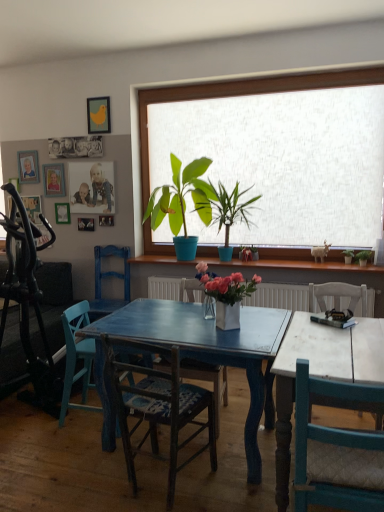
Question: Is teal wood chair at right, the fifth chair from the back, at the back of blue painted wood chair at left, which appears as the fifth chair when viewed from the front?

Choices:
 (A) yes
 (B) no

Answer: (B)

Question: From the image's perspective, is blue painted wood chair at left, which is counted as the first chair, starting from the back, under teal wood chair at right, the first chair from the front?

Choices:
 (A) no
 (B) yes

Answer: (A)

Question: Could teal wood chair at right, the fifth chair from the back, be considered to be inside blue painted wood chair at left, which is counted as the first chair, starting from the back?

Choices:
 (A) no
 (B) yes

Answer: (A)

Question: Considering the relative sizes of blue painted wood chair at left, which appears as the fifth chair when viewed from the front, and teal wood chair at right, the first chair from the front, in the image provided, is blue painted wood chair at left, which appears as the fifth chair when viewed from the front, shorter than teal wood chair at right, the first chair from the front,?

Choices:
 (A) no
 (B) yes

Answer: (B)

Question: Can you confirm if blue painted wood chair at left, which is counted as the first chair, starting from the back, is positioned to the right of teal wood chair at right, the fifth chair from the back?

Choices:
 (A) no
 (B) yes

Answer: (A)

Question: Could you tell me if blue painted wood chair at left, which is counted as the first chair, starting from the back, is facing teal wood chair at right, the first chair from the front?

Choices:
 (A) no
 (B) yes

Answer: (A)

Question: Are wooden photo frame at upper left, the fifth picture frame positioned from the right, and teal wood chair at right, the fifth chair from the back, far apart?

Choices:
 (A) no
 (B) yes

Answer: (B)

Question: From a real-world perspective, is wooden photo frame at upper left, marked as the 1th picture frame in a left-to-right arrangement, over teal wood chair at right, the fifth chair from the back?

Choices:
 (A) no
 (B) yes

Answer: (B)

Question: Does wooden photo frame at upper left, marked as the 1th picture frame in a left-to-right arrangement, appear on the right side of teal wood chair at right, the first chair from the front?

Choices:
 (A) no
 (B) yes

Answer: (A)

Question: From a real-world perspective, is wooden photo frame at upper left, marked as the 1th picture frame in a left-to-right arrangement, physically below teal wood chair at right, the fifth chair from the back?

Choices:
 (A) no
 (B) yes

Answer: (A)

Question: Can you confirm if wooden photo frame at upper left, the fifth picture frame positioned from the right, is smaller than teal wood chair at right, the first chair from the front?

Choices:
 (A) yes
 (B) no

Answer: (A)

Question: Considering the relative sizes of wooden photo frame at upper left, marked as the 1th picture frame in a left-to-right arrangement, and teal wood chair at right, the first chair from the front, in the image provided, is wooden photo frame at upper left, marked as the 1th picture frame in a left-to-right arrangement, shorter than teal wood chair at right, the first chair from the front,?

Choices:
 (A) no
 (B) yes

Answer: (B)

Question: Is wooden picture frame at upper left, the second picture frame from the left, turned away from wooden chair with woven seat at center, marked as the 4th chair in a back-to-front arrangement?

Choices:
 (A) yes
 (B) no

Answer: (B)